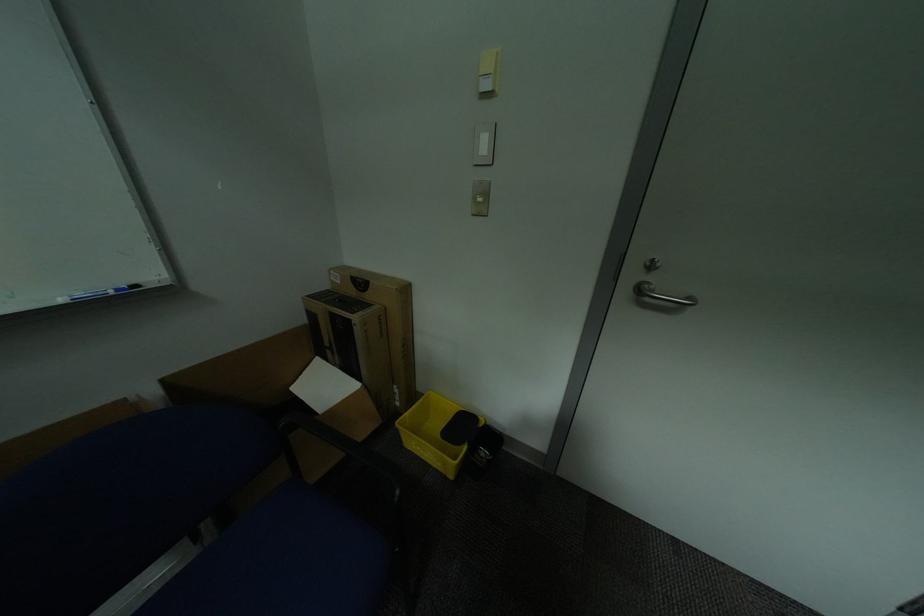
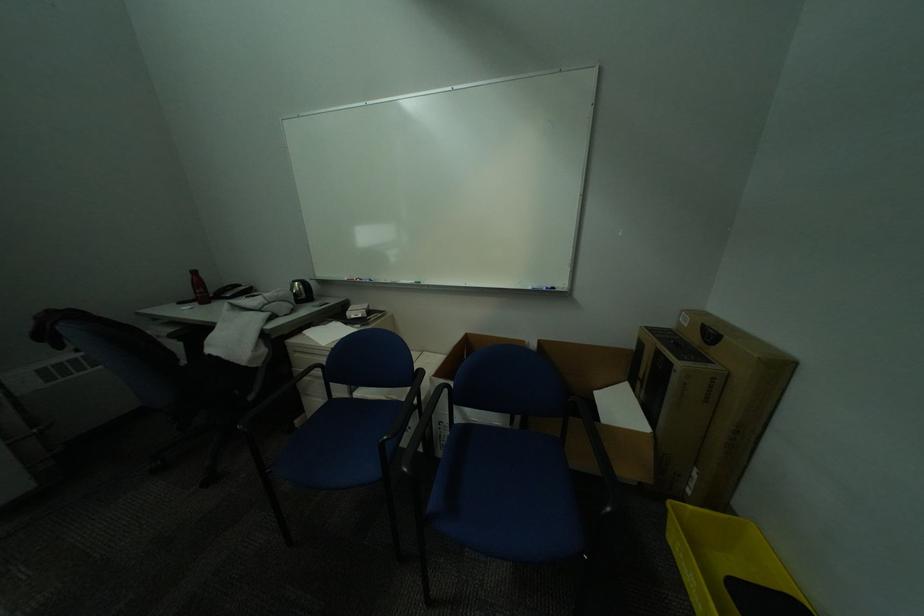
The point at (418, 415) is marked in the first image. Where is the corresponding point in the second image?

(701, 508)